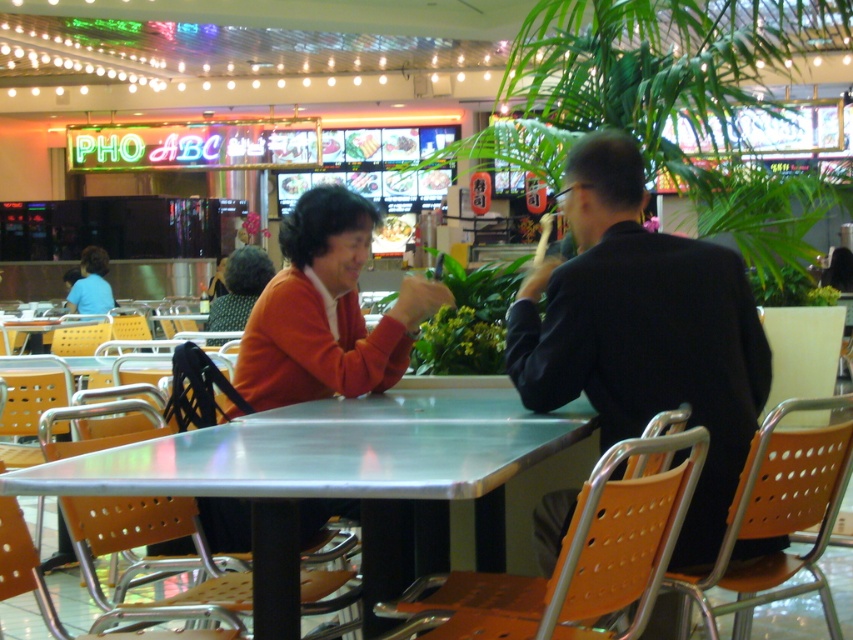
Can you confirm if black matte suit at center is shorter than metallic silver table at center?

In fact, black matte suit at center may be taller than metallic silver table at center.

Based on the photo, who is more distant from viewer, (664, 262) or (415, 458)?

The point (664, 262) is behind.

Does point (554, 406) lie in front of point (282, 472)?

No, (554, 406) is further to viewer.

The width and height of the screenshot is (853, 640). I want to click on black matte suit at center, so click(x=643, y=332).

Which is more to the left, metallic silver table at center or metallic orange chair at center?

Positioned to the left is metallic orange chair at center.

Between metallic silver table at center and metallic orange chair at center, which one has less height?

Standing shorter between the two is metallic silver table at center.

Does point (187, 433) come in front of point (33, 576)?

No, it is not.

Find the location of a particular element. metallic silver table at center is located at coordinates (339, 477).

Who is more forward, (26, 381) or (97, 262)?

Point (26, 381) is more forward.

The width and height of the screenshot is (853, 640). Find the location of `metallic orange chair at lower left`. metallic orange chair at lower left is located at coordinates (32, 392).